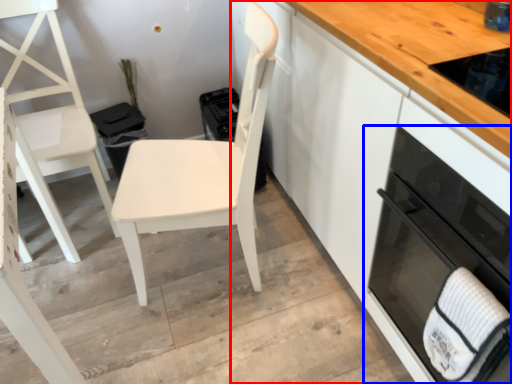
Question: Which object appears closest to the camera in this image, cabinetry (highlighted by a red box) or home appliance (highlighted by a blue box)?

Choices:
 (A) cabinetry
 (B) home appliance

Answer: (B)